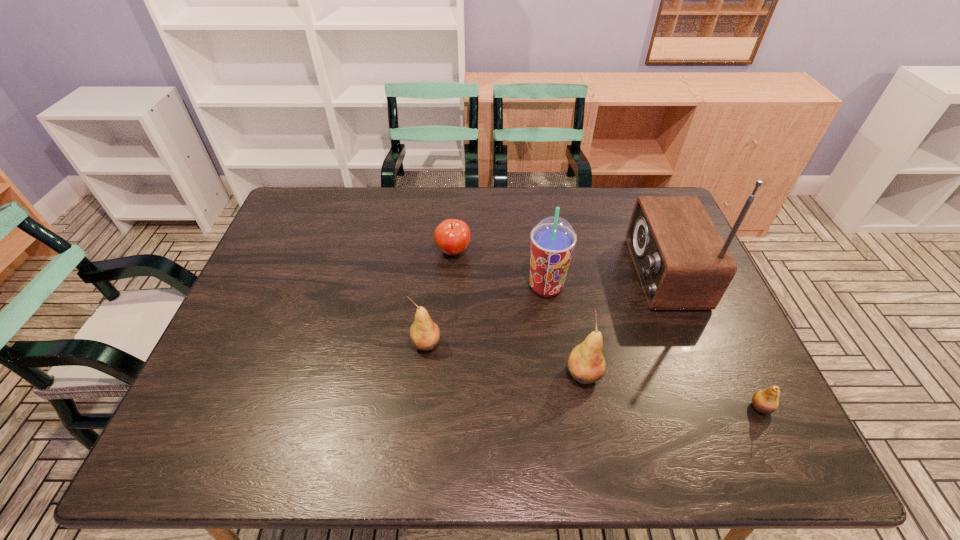
Image resolution: width=960 pixels, height=540 pixels. What are the coordinates of `vacant space located on the right of the second pear from left to right` in the screenshot? It's located at (739, 374).

What are the coordinates of `vacant space located 0.050m on the back of the shortest pear` in the screenshot? It's located at (747, 379).

Find the location of a particular element. The image size is (960, 540). free space located 0.050m on the front-facing side of the radio receiver is located at coordinates (613, 273).

Where is `free location located 0.130m on the front-facing side of the radio receiver`? free location located 0.130m on the front-facing side of the radio receiver is located at coordinates (587, 273).

Where is `vacant space situated 0.050m on the front-facing side of the radio receiver`? vacant space situated 0.050m on the front-facing side of the radio receiver is located at coordinates (x=613, y=273).

This screenshot has width=960, height=540. I want to click on vacant area situated on the back of the apple, so 455,225.

Locate an element on the screen. free space located 0.280m on the back of the second tallest object is located at coordinates (536, 214).

Identify the location of pear that is positioned at the right edge. (766, 401).

Identify the location of radio receiver positioned at the right edge. This screenshot has width=960, height=540. click(x=682, y=262).

Locate an element on the screen. Image resolution: width=960 pixels, height=540 pixels. object that is at the near right corner is located at coordinates (766, 401).